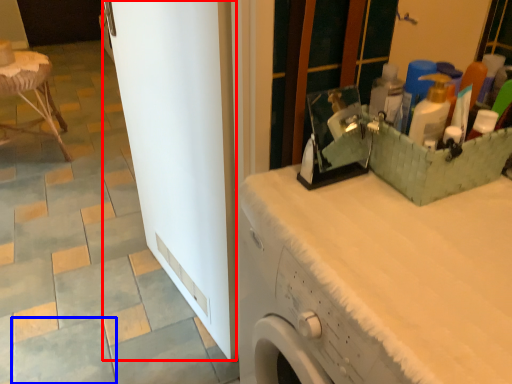
Question: Which object is further to the camera taking this photo, screen door (highlighted by a red box) or ceramic tile (highlighted by a blue box)?

Choices:
 (A) screen door
 (B) ceramic tile

Answer: (B)